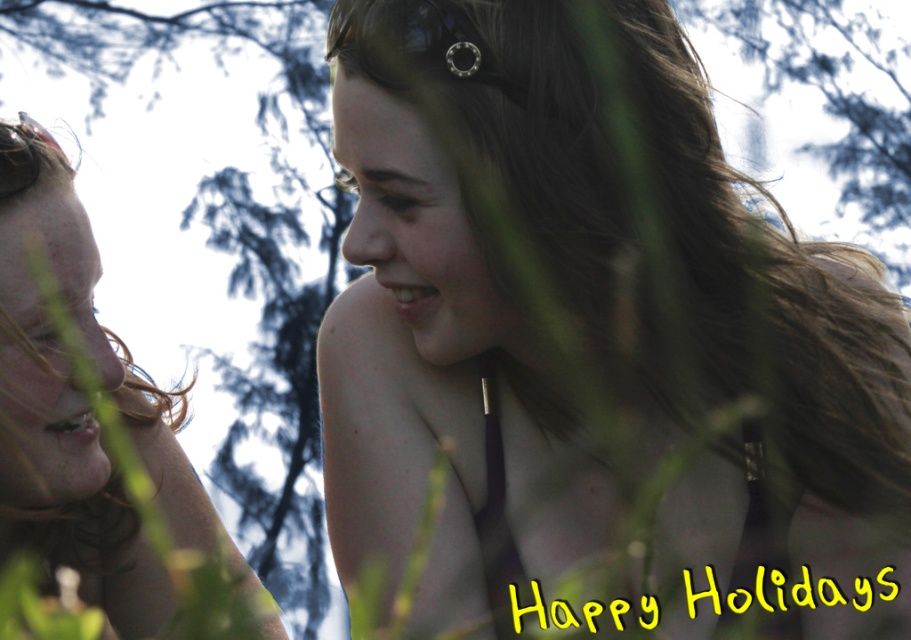
From the picture: Does matte purple bikini top at center have a smaller size compared to shiny metallic goggles at upper left?

Incorrect, matte purple bikini top at center is not smaller in size than shiny metallic goggles at upper left.

Is matte purple bikini top at center shorter than shiny metallic goggles at upper left?

In fact, matte purple bikini top at center may be taller than shiny metallic goggles at upper left.

Does point (497, 628) come farther from viewer compared to point (8, 157)?

Yes, it is behind point (8, 157).

Where is `matte purple bikini top at center`? matte purple bikini top at center is located at coordinates (763, 541).

Looking at this image, does smooth brown hair at center appear under matte purple bikini top at center?

No.

Which is behind, point (567, 67) or point (492, 604)?

Positioned behind is point (492, 604).

Where is `smooth brown hair at center`? This screenshot has height=640, width=911. smooth brown hair at center is located at coordinates (595, 340).

Describe the element at coordinates (595, 340) in the screenshot. I see `smooth brown hair at center` at that location.

Consider the image. Is smooth brown hair at center to the right of matte skin tone face at left from the viewer's perspective?

Yes, smooth brown hair at center is to the right of matte skin tone face at left.

Find the location of a particular element. This screenshot has width=911, height=640. smooth brown hair at center is located at coordinates (595, 340).